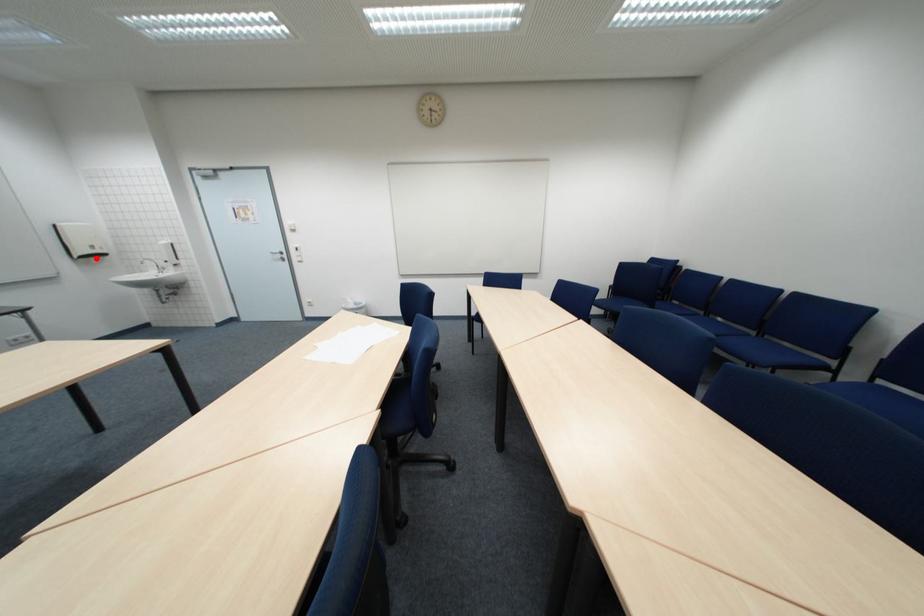
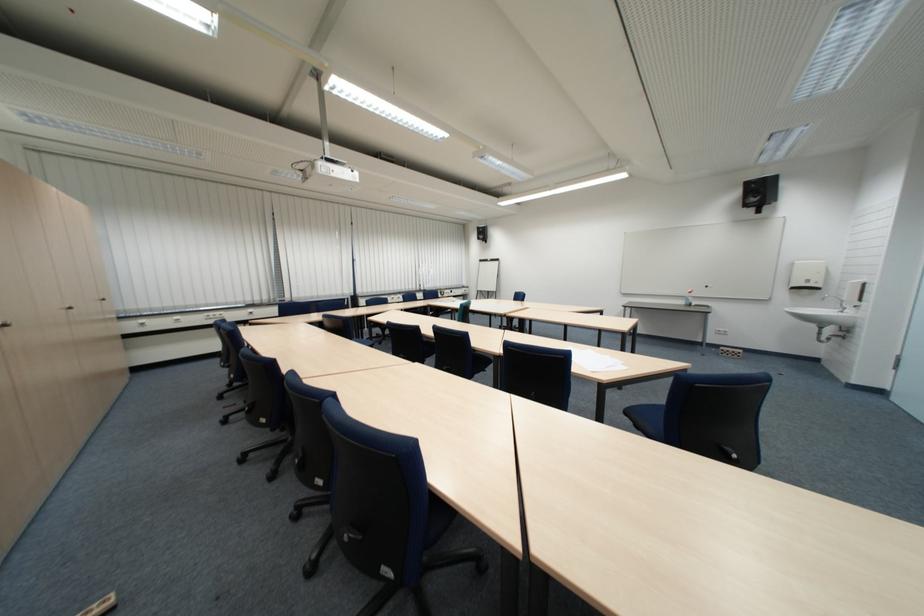
Question: I am providing you with two images of the same scene from different viewpoints. Image1 has a red point marked. In image2, the corresponding 3D location appears at what relative position? Reply with the corresponding letter.

Choices:
 (A) Closer
 (B) Farther

Answer: (B)